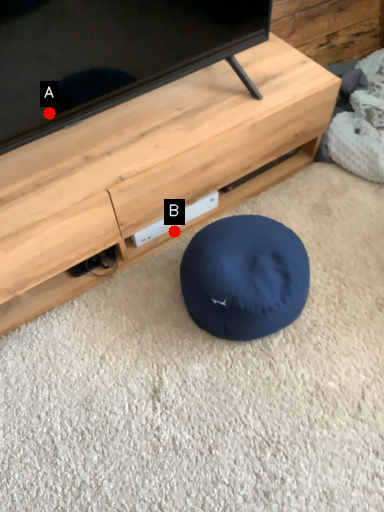
Question: Two points are circled on the image, labeled by A and B beside each circle. Which point is closer to the camera taking this photo?

Choices:
 (A) A is closer
 (B) B is closer

Answer: (A)